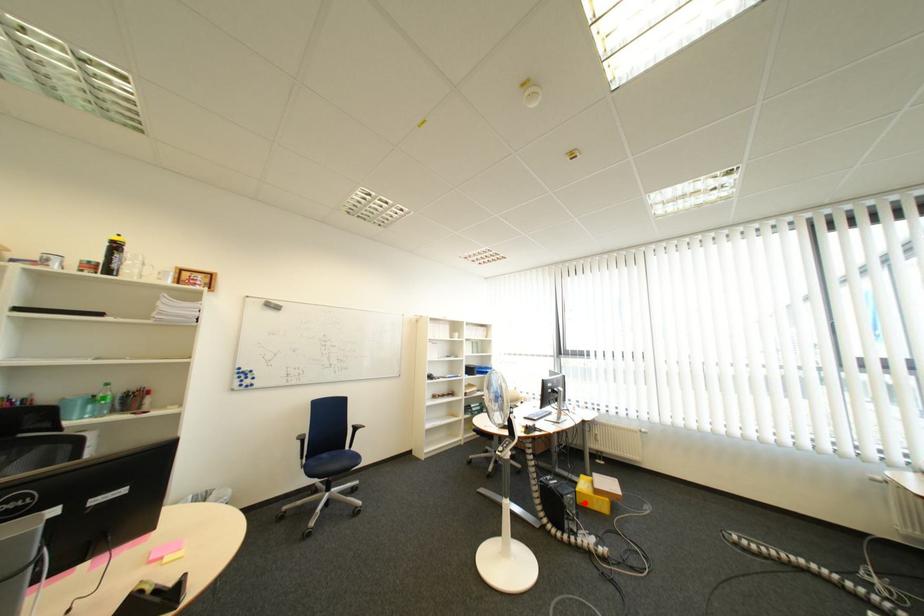
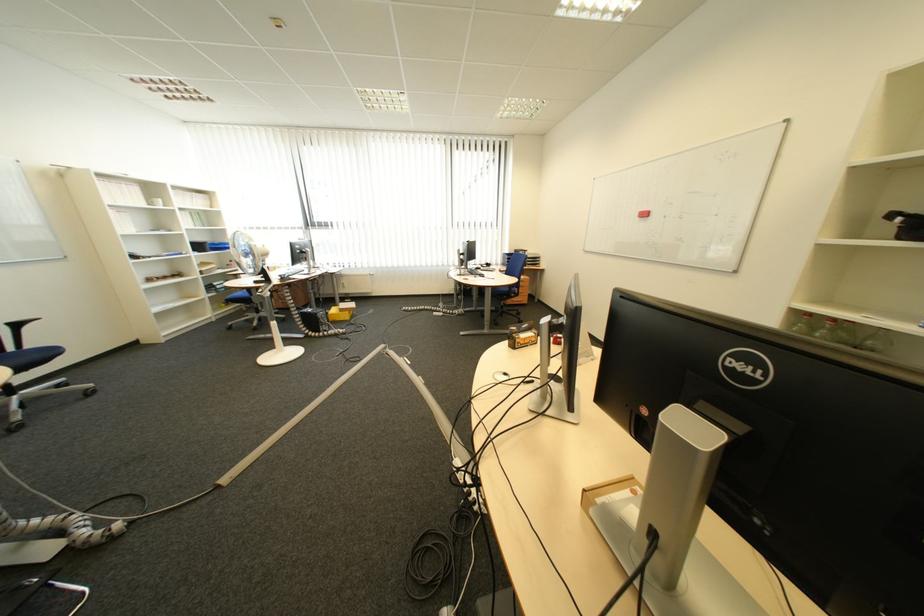
Where in the second image is the point corresponding to the highlighted location from the first image?

(335, 317)